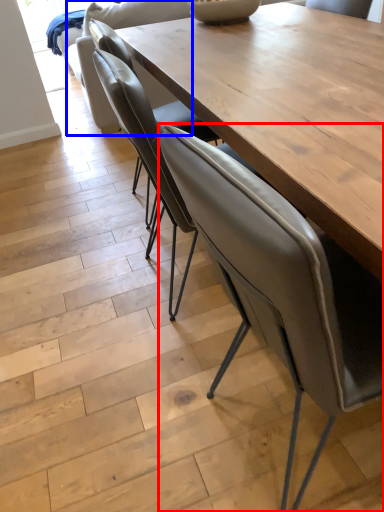
Question: Which of the following is the closest to the observer, chair (highlighted by a red box) or armchair (highlighted by a blue box)?

Choices:
 (A) chair
 (B) armchair

Answer: (A)